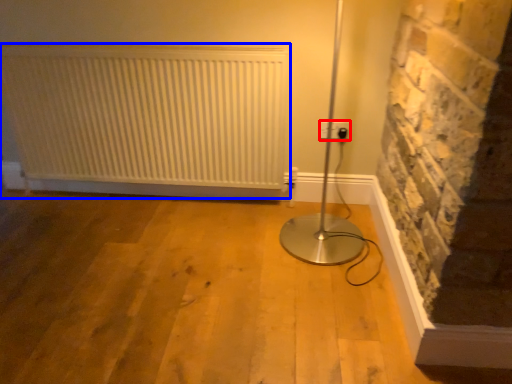
Question: Which point is further to the camera, electric outlet (highlighted by a red box) or radiator (highlighted by a blue box)?

Choices:
 (A) electric outlet
 (B) radiator

Answer: (A)